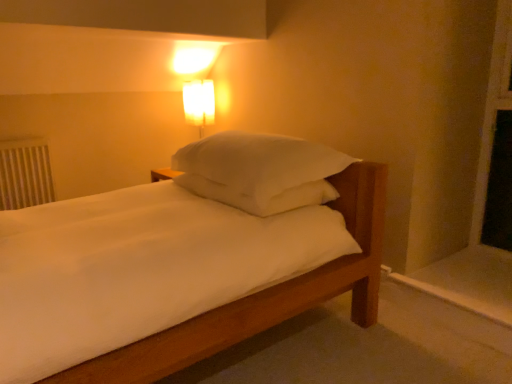
Question: Considering the relative sizes of white plastic radiator at left and white soft pillow at center in the image provided, is white plastic radiator at left taller than white soft pillow at center?

Choices:
 (A) yes
 (B) no

Answer: (A)

Question: Is white plastic radiator at left to the left of white soft pillow at center from the viewer's perspective?

Choices:
 (A) yes
 (B) no

Answer: (A)

Question: Is white plastic radiator at left turned away from white soft pillow at center?

Choices:
 (A) yes
 (B) no

Answer: (B)

Question: Does white plastic radiator at left have a smaller size compared to white soft pillow at center?

Choices:
 (A) no
 (B) yes

Answer: (B)

Question: Is white plastic radiator at left not near white soft pillow at center?

Choices:
 (A) yes
 (B) no

Answer: (A)

Question: From their relative heights in the image, would you say white plastic radiator at left is taller or shorter than white soft pillow at center?

Choices:
 (A) short
 (B) tall

Answer: (B)

Question: Is white plastic radiator at left wider or thinner than white soft pillow at center?

Choices:
 (A) thin
 (B) wide

Answer: (A)

Question: Does point (5, 208) appear closer or farther from the camera than point (303, 160)?

Choices:
 (A) farther
 (B) closer

Answer: (A)

Question: From a real-world perspective, is white plastic radiator at left physically located above or below white soft pillow at center?

Choices:
 (A) below
 (B) above

Answer: (A)

Question: Is point (227, 185) closer or farther from the camera than point (159, 379)?

Choices:
 (A) closer
 (B) farther

Answer: (B)

Question: Would you say white soft pillow at center is to the left or to the right of wooden bed frame at lower center in the picture?

Choices:
 (A) right
 (B) left

Answer: (B)

Question: Looking at their shapes, would you say white soft pillow at center is wider or thinner than wooden bed frame at lower center?

Choices:
 (A) thin
 (B) wide

Answer: (A)

Question: In terms of size, does white soft pillow at center appear bigger or smaller than wooden bed frame at lower center?

Choices:
 (A) big
 (B) small

Answer: (A)

Question: From a real-world perspective, is white plastic radiator at left positioned above or below matte glass lampshade at upper center?

Choices:
 (A) below
 (B) above

Answer: (A)

Question: From the image's perspective, relative to matte glass lampshade at upper center, is white plastic radiator at left above or below?

Choices:
 (A) below
 (B) above

Answer: (A)